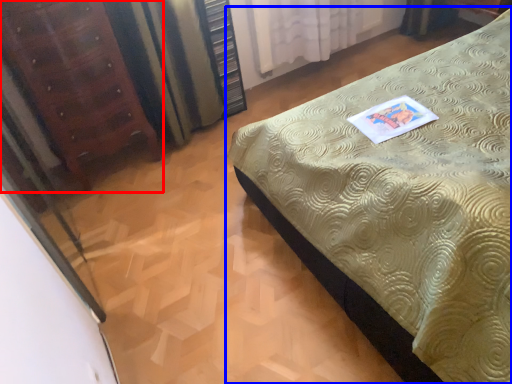
Question: Which object is closer to the camera taking this photo, furniture (highlighted by a red box) or bed (highlighted by a blue box)?

Choices:
 (A) furniture
 (B) bed

Answer: (B)